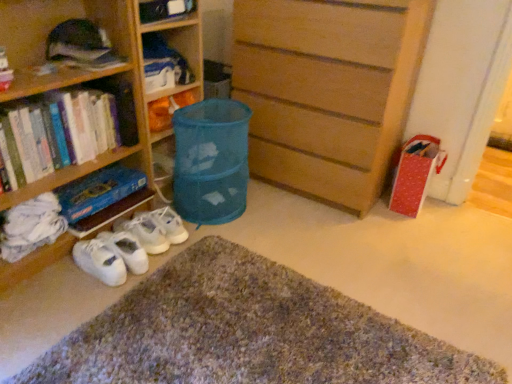
I want to click on vacant region in front of blue fabric laundry basket at center, so click(x=231, y=238).